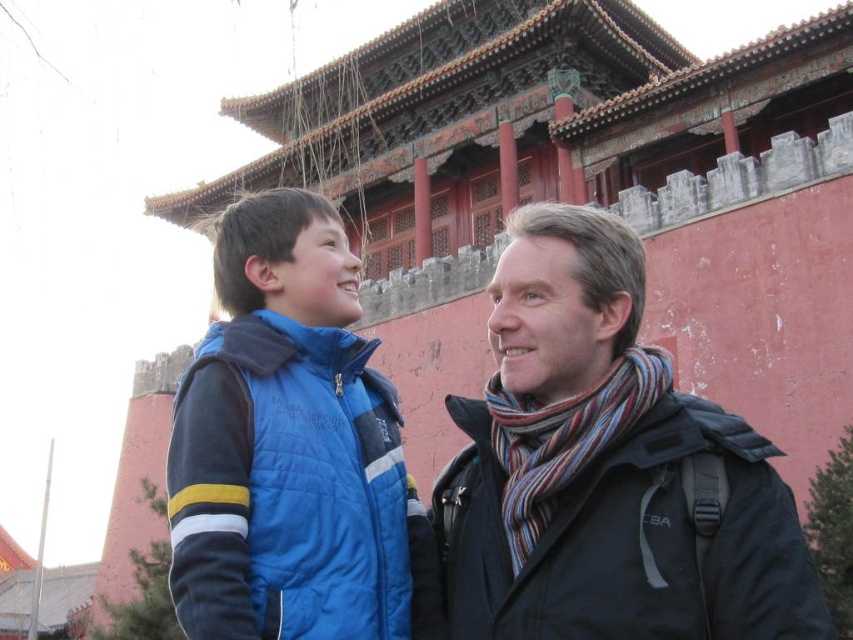
You are standing in front of the traditional Chinese building and see a point marked at coordinates [605,468]. Based on the scene, can you identify which object this point is located on?

The point at coordinates [605,468] is located on the dark gray wool scarf at right.

You are a photographer trying to capture a photo of the two people in front of the traditional Chinese building. You want to ensure both the dark gray wool scarf at right and the blue quilted vest at center are clearly visible in the frame. Which object should you focus on first to ensure both are in focus?

The dark gray wool scarf at right is positioned on the right side of the blue quilted vest at center. To ensure both are in focus, you should focus on the blue quilted vest at center first since it is closer to the center of the image and the scarf is positioned to its right, allowing for a balanced focus.